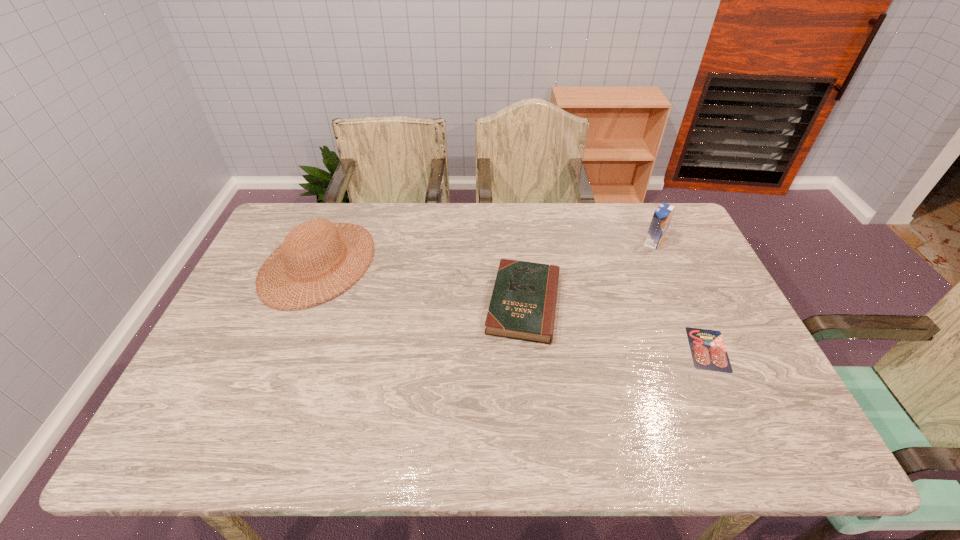
Point out which object is positioned as the nearest to the leftmost object. Please provide its 2D coordinates. Your answer should be formatted as a tuple, i.e. [(x, y)], where the tuple contains the x and y coordinates of a point satisfying the conditions above.

[(523, 304)]

Choose which object is the second nearest neighbor to the leftmost object. Please provide its 2D coordinates. Your answer should be formatted as a tuple, i.e. [(x, y)], where the tuple contains the x and y coordinates of a point satisfying the conditions above.

[(662, 215)]

This screenshot has width=960, height=540. What are the coordinates of `free space that satisfies the following two spatial constraints: 1. on the front side of the third tallest object; 2. on the left side of the third shortest object` in the screenshot? It's located at (302, 303).

Where is `vacant point that satisfies the following two spatial constraints: 1. on the front side of the tallest object; 2. on the right side of the salami`? The image size is (960, 540). vacant point that satisfies the following two spatial constraints: 1. on the front side of the tallest object; 2. on the right side of the salami is located at coordinates (702, 349).

Identify the location of free region that satisfies the following two spatial constraints: 1. on the front side of the salami; 2. on the right side of the leftmost object. This screenshot has height=540, width=960. (284, 349).

Where is `free point that satisfies the following two spatial constraints: 1. on the front side of the Bible; 2. on the left side of the salami`? free point that satisfies the following two spatial constraints: 1. on the front side of the Bible; 2. on the left side of the salami is located at coordinates (528, 349).

What are the coordinates of `vacant space that satisfies the following two spatial constraints: 1. on the front side of the salami; 2. on the left side of the second shortest object` in the screenshot? It's located at (528, 349).